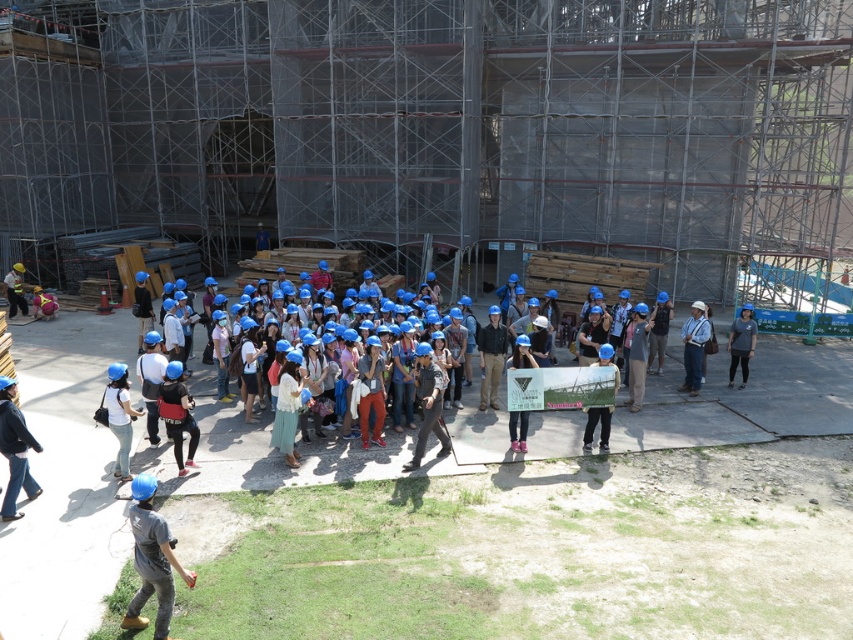
You are a construction worker standing on the paved area. You see a white matte shirt at center and a white fabric at center. Which object is closer to the ground?

The white matte shirt at center is located below the white fabric at center, so the white matte shirt at center is closer to the ground.

You are standing at the construction site shown in the image. You need to locate the point with coordinates (741, 342). According to the scene, where would this point be located?

The point at coordinates (741, 342) is on the gray matte shirt at right.

You are a photographer at the construction site scene. You need to capture a photo that includes both the white matte shirt at center and the white fabric at center. Which object should you focus on first if you want to ensure both are in frame without moving the camera?

The white matte shirt at center has a lesser height compared to white fabric at center, so you should focus on the white fabric at center first to ensure both are in frame.